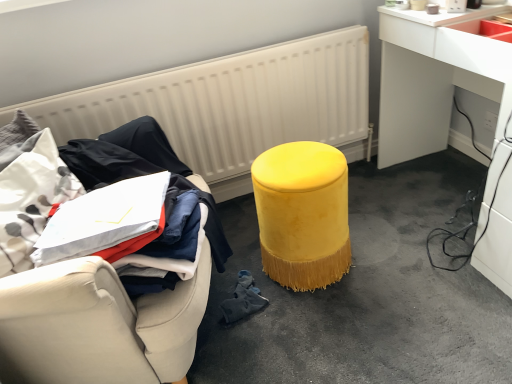
At what (x,y) coordinates should I click in order to perform the action: click on vacant area that lies between white glossy desk at right and velvet yellow stool at center. Please return your answer as a coordinate pair (x, y). This screenshot has height=384, width=512. Looking at the image, I should click on (380, 229).